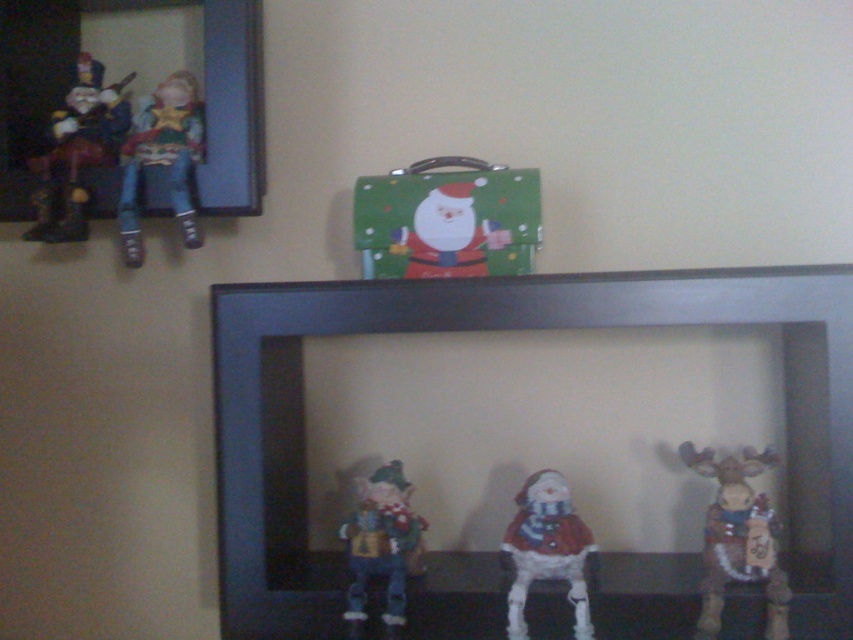
You are hanging a new picture in the room and need to know which object on the mantelpiece is larger to ensure proper spacing. Which is bigger between the wooden frame at upper left and the wooden horse at upper left?

The wooden frame at upper left is bigger than the wooden horse at upper left, so you should consider its size when spacing.

You are standing in front of the mantelpiece and want to hang a small hook exactly at the point marked by point (71,76). Is this point located on the wooden frame at upper left?

Yes, the point (71,76) marks the wooden frame at upper left, so the hook can be placed there.